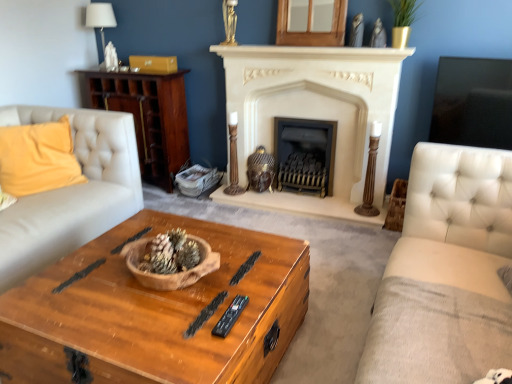
The width and height of the screenshot is (512, 384). In order to click on free area in between black plastic remote at center and brown textured pine cone at center in this screenshot , I will do `click(204, 296)`.